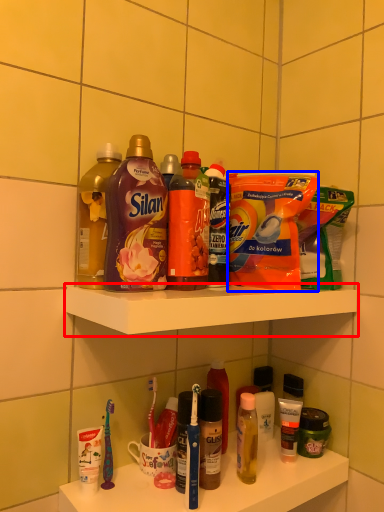
Question: Among these objects, which one is farthest to the camera, shelf (highlighted by a red box) or cleaning product (highlighted by a blue box)?

Choices:
 (A) shelf
 (B) cleaning product

Answer: (B)